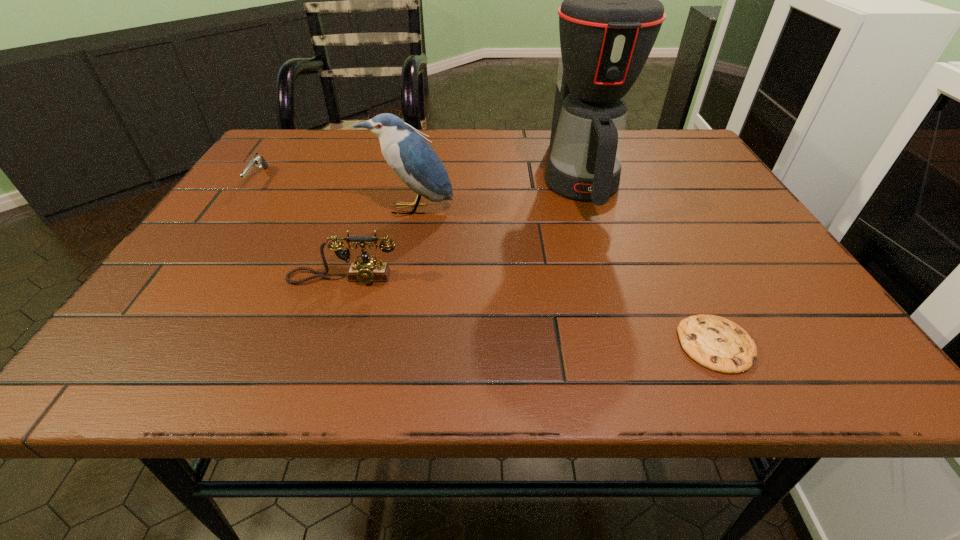
Identify the location of the tallest object. (610, 17).

Find the location of `the second tallest object`. the second tallest object is located at coordinates (409, 155).

Locate an element on the screen. The image size is (960, 540). the third shortest object is located at coordinates (367, 270).

Where is `the fourth farthest object`? The image size is (960, 540). the fourth farthest object is located at coordinates (367, 270).

At what (x,y) coordinates should I click in order to perform the action: click on the leftmost object. Please return your answer as a coordinate pair (x, y). Looking at the image, I should click on (257, 161).

Where is `the second shortest object`? The width and height of the screenshot is (960, 540). the second shortest object is located at coordinates (257, 161).

Find the location of `the nearest object`. the nearest object is located at coordinates (719, 344).

Locate an element on the screen. the shortest object is located at coordinates (719, 344).

The height and width of the screenshot is (540, 960). I want to click on free region located 0.290m pour from the carafe of the tallest object, so click(628, 329).

The width and height of the screenshot is (960, 540). Find the location of `vacant space located at the tip of the fourth shortest object's beak`. vacant space located at the tip of the fourth shortest object's beak is located at coordinates (392, 306).